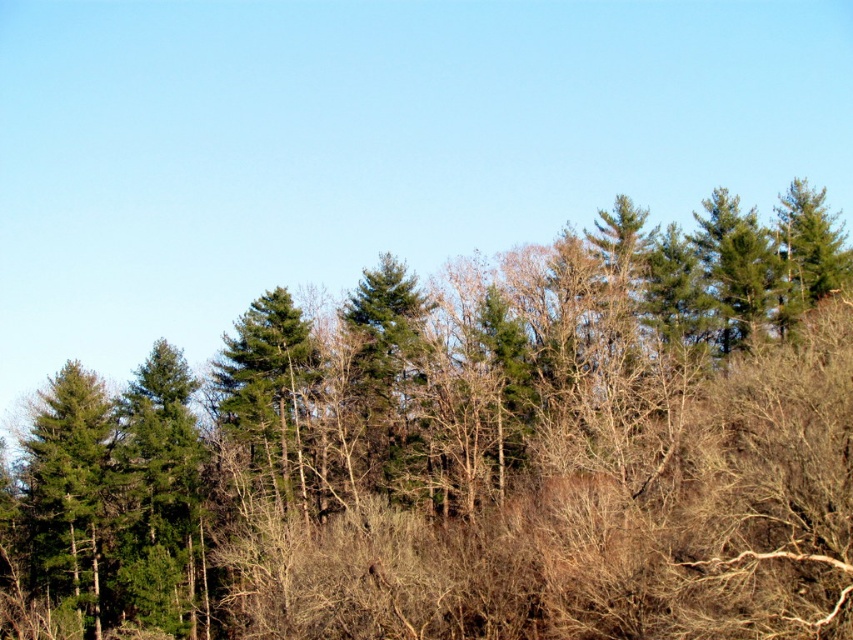
You are standing in the forest and want to determine which of the two points, point (515, 340) or point (39, 547), is closer to you. Based on the scene description, which point is nearer?

Point (515, 340) is closer to the camera than point 0.8, 0.048, so it is the nearer one.

You are standing in the forest and want to walk towards the green matte trees at center and the green matte tree at left. Which one will you reach first?

You will reach the green matte trees at center first because it is closer to the viewer than the green matte tree at left.